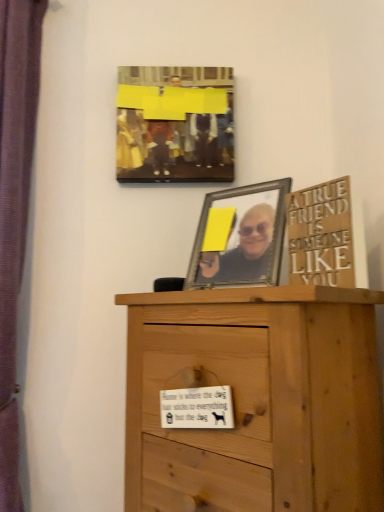
Question: Can you confirm if purple fabric curtain at left is bigger than wooden sign at upper right?

Choices:
 (A) yes
 (B) no

Answer: (A)

Question: Is purple fabric curtain at left aimed at wooden sign at upper right?

Choices:
 (A) no
 (B) yes

Answer: (A)

Question: Does purple fabric curtain at left have a greater height compared to wooden sign at upper right?

Choices:
 (A) yes
 (B) no

Answer: (A)

Question: Does purple fabric curtain at left come in front of wooden sign at upper right?

Choices:
 (A) yes
 (B) no

Answer: (B)

Question: Can you confirm if purple fabric curtain at left is smaller than wooden sign at upper right?

Choices:
 (A) no
 (B) yes

Answer: (A)

Question: From the image's perspective, is purple fabric curtain at left above wooden sign at upper right?

Choices:
 (A) no
 (B) yes

Answer: (B)

Question: From the image's perspective, is light brown wood chest of drawers at center located beneath wooden sign at upper right?

Choices:
 (A) no
 (B) yes

Answer: (B)

Question: Does light brown wood chest of drawers at center have a smaller size compared to wooden sign at upper right?

Choices:
 (A) no
 (B) yes

Answer: (A)

Question: Does light brown wood chest of drawers at center have a lesser width compared to wooden sign at upper right?

Choices:
 (A) no
 (B) yes

Answer: (A)

Question: Considering the relative positions of light brown wood chest of drawers at center and wooden sign at upper right in the image provided, is light brown wood chest of drawers at center to the right of wooden sign at upper right from the viewer's perspective?

Choices:
 (A) yes
 (B) no

Answer: (B)

Question: Is wooden sign at upper right at the back of light brown wood chest of drawers at center?

Choices:
 (A) no
 (B) yes

Answer: (A)

Question: From the image's perspective, is light brown wood chest of drawers at center on top of wooden sign at upper right?

Choices:
 (A) no
 (B) yes

Answer: (A)

Question: From a real-world perspective, does matte yellow canvas at upper center stand above light brown wood chest of drawers at center?

Choices:
 (A) yes
 (B) no

Answer: (A)